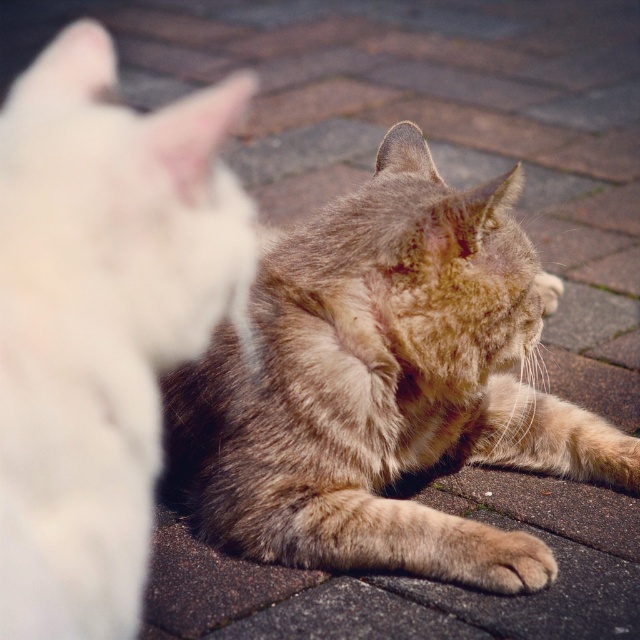
Is point (490, 248) in front of point (140, 531)?

No, (490, 248) is behind (140, 531).

Is tabby fur cat at center in front of fluffy white cat at center?

No, tabby fur cat at center is further to the viewer.

Does point (330, 449) lie behind point (3, 316)?

Yes.

The height and width of the screenshot is (640, 640). I want to click on tabby fur cat at center, so click(x=378, y=376).

Which of these two, tabby fur cat at center or soft fur paw at lower center, stands taller?

tabby fur cat at center is taller.

Does tabby fur cat at center appear on the left side of soft fur paw at lower center?

Correct, you'll find tabby fur cat at center to the left of soft fur paw at lower center.

This screenshot has height=640, width=640. Identify the location of tabby fur cat at center. (378, 376).

Between fluffy white cat at center and soft fur paw at lower center, which one has more height?

fluffy white cat at center is taller.

Can you confirm if fluffy white cat at center is positioned to the right of soft fur paw at lower center?

In fact, fluffy white cat at center is to the left of soft fur paw at lower center.

Describe the element at coordinates (100, 323) in the screenshot. I see `fluffy white cat at center` at that location.

Where is `fluffy white cat at center`? fluffy white cat at center is located at coordinates (100, 323).